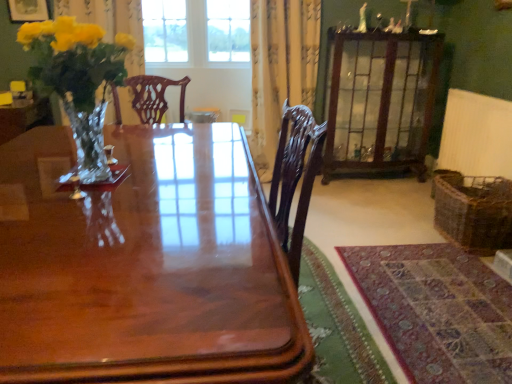
Question: Would you say glossy wood table at center is outside white textured radiator at right?

Choices:
 (A) yes
 (B) no

Answer: (A)

Question: Is glossy wood table at center next to white textured radiator at right?

Choices:
 (A) no
 (B) yes

Answer: (A)

Question: Does glossy wood table at center contain white textured radiator at right?

Choices:
 (A) yes
 (B) no

Answer: (B)

Question: Are glossy wood table at center and white textured radiator at right far apart?

Choices:
 (A) yes
 (B) no

Answer: (A)

Question: Considering the relative sizes of glossy wood table at center and white textured radiator at right in the image provided, is glossy wood table at center shorter than white textured radiator at right?

Choices:
 (A) no
 (B) yes

Answer: (A)

Question: From a real-world perspective, is glossy wood table at center below white textured radiator at right?

Choices:
 (A) yes
 (B) no

Answer: (A)

Question: Is wooden glass cabinet at upper right taller than glossy wood table at center?

Choices:
 (A) no
 (B) yes

Answer: (B)

Question: Is glossy wood table at center inside wooden glass cabinet at upper right?

Choices:
 (A) yes
 (B) no

Answer: (B)

Question: Is wooden glass cabinet at upper right in front of glossy wood table at center?

Choices:
 (A) no
 (B) yes

Answer: (A)

Question: Is wooden glass cabinet at upper right to the right of glossy wood table at center from the viewer's perspective?

Choices:
 (A) yes
 (B) no

Answer: (A)

Question: From the image's perspective, is wooden glass cabinet at upper right over glossy wood table at center?

Choices:
 (A) no
 (B) yes

Answer: (B)

Question: From a real-world perspective, is wooden glass cabinet at upper right under glossy wood table at center?

Choices:
 (A) no
 (B) yes

Answer: (A)

Question: Is matte gold picture frame at upper left not near glossy wood table at center?

Choices:
 (A) yes
 (B) no

Answer: (A)